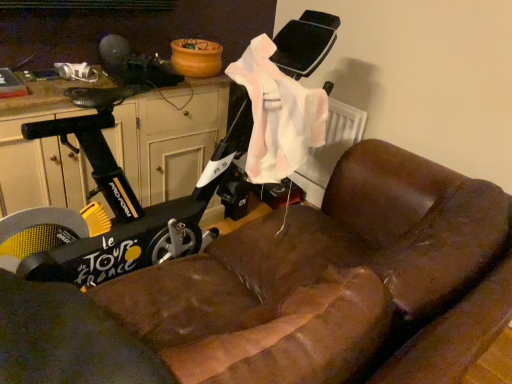
Question: Considering the positions of point (292, 266) and point (155, 142), is point (292, 266) closer or farther from the camera than point (155, 142)?

Choices:
 (A) farther
 (B) closer

Answer: (B)

Question: In terms of width, does brown leather couch at lower right look wider or thinner when compared to wooden dresser at left?

Choices:
 (A) thin
 (B) wide

Answer: (B)

Question: Is brown leather couch at lower right taller or shorter than wooden dresser at left?

Choices:
 (A) tall
 (B) short

Answer: (A)

Question: Considering the positions of wooden dresser at left and brown leather couch at lower right in the image, is wooden dresser at left bigger or smaller than brown leather couch at lower right?

Choices:
 (A) small
 (B) big

Answer: (A)

Question: From a real-world perspective, is wooden dresser at left above or below brown leather couch at lower right?

Choices:
 (A) below
 (B) above

Answer: (B)

Question: Would you say wooden dresser at left is to the left or to the right of brown leather couch at lower right in the picture?

Choices:
 (A) right
 (B) left

Answer: (B)

Question: From the image's perspective, relative to brown leather couch at lower right, is wooden dresser at left above or below?

Choices:
 (A) below
 (B) above

Answer: (B)